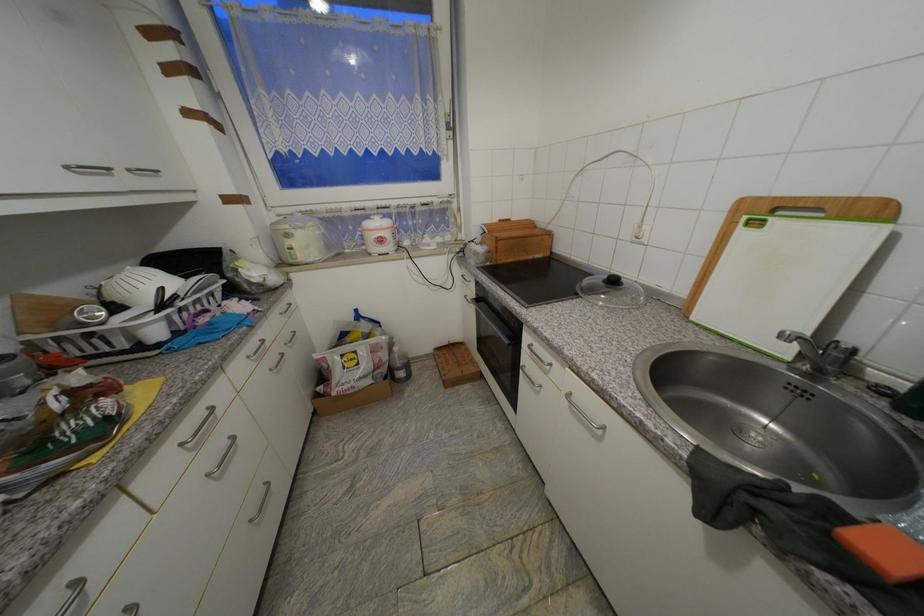
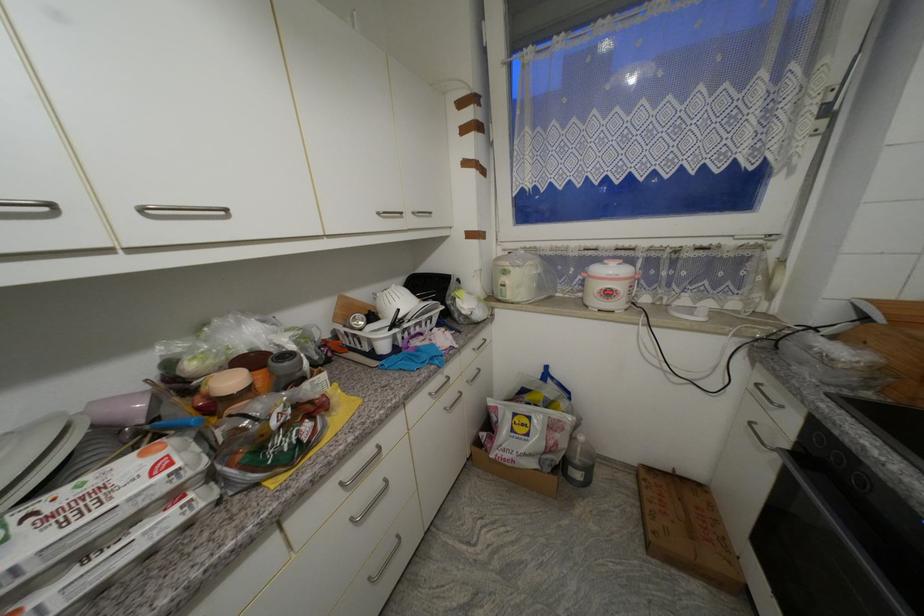
Question: The camera is either moving clockwise (left) or counter-clockwise (right) around the object. The first image is from the beginning of the video and the second image is from the end. Is the camera moving left or right when shooting the video?

Choices:
 (A) Left
 (B) Right

Answer: (B)